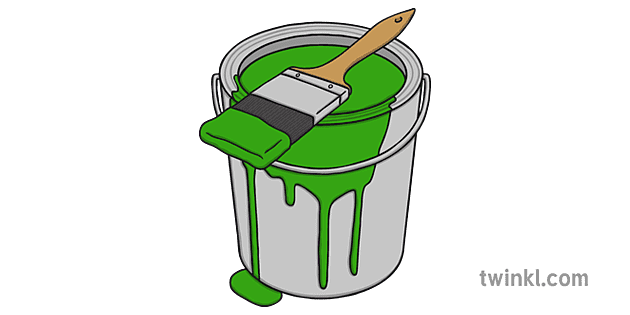
Locate an element on the screen. spilled paint is located at coordinates (258, 285).